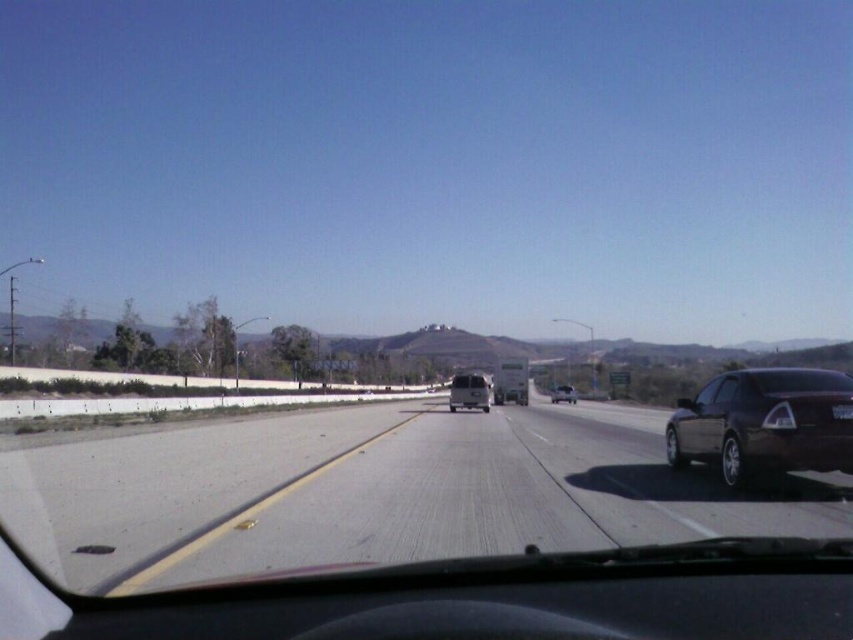
You are a driver navigating a vehicle and need to stay on the asphalt road at center. According to the image, what coordinates should you aim for to stay on the road?

The asphalt road at center is located at coordinates point (376, 492), so you should aim for that point to stay on the road.

You are a driver in a vehicle and want to know if the point at coordinates (469, 392) is on the matte silver van at center. Is it?

Yes, the point at coordinates (469, 392) is on the matte silver van at center as stated in the Objects Description.

You are driving a car and see the asphalt road at center and the shiny silver sedan at center ahead. Which object is closer to you?

The asphalt road at center is closer to you because it is in front of the shiny silver sedan at center.